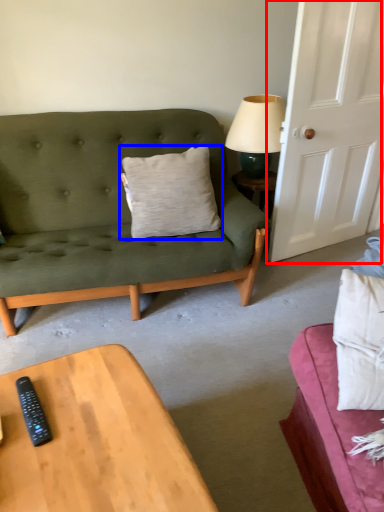
Question: Which point is closer to the camera, door (highlighted by a red box) or pillow (highlighted by a blue box)?

Choices:
 (A) door
 (B) pillow

Answer: (A)